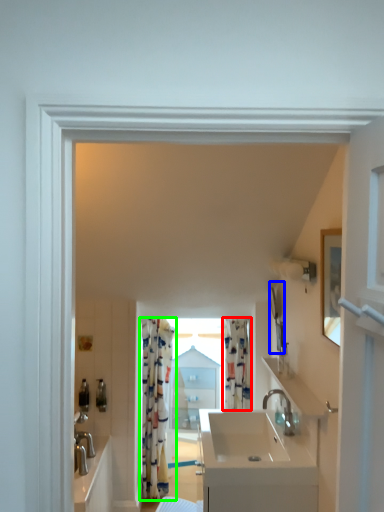
Question: Which is nearer to the curtain (highlighted by a red box)? mirror (highlighted by a blue box) or curtain (highlighted by a green box).

Choices:
 (A) mirror
 (B) curtain

Answer: (A)